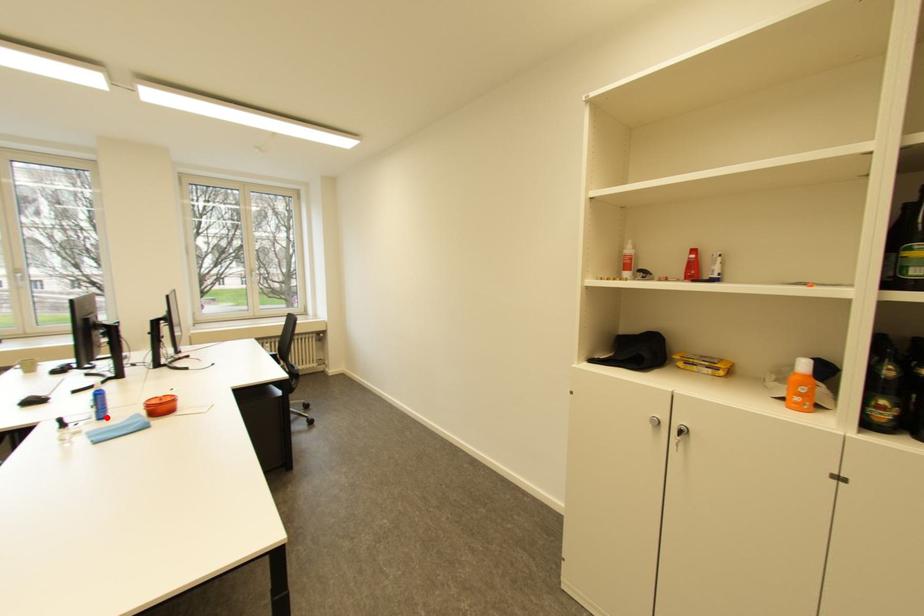
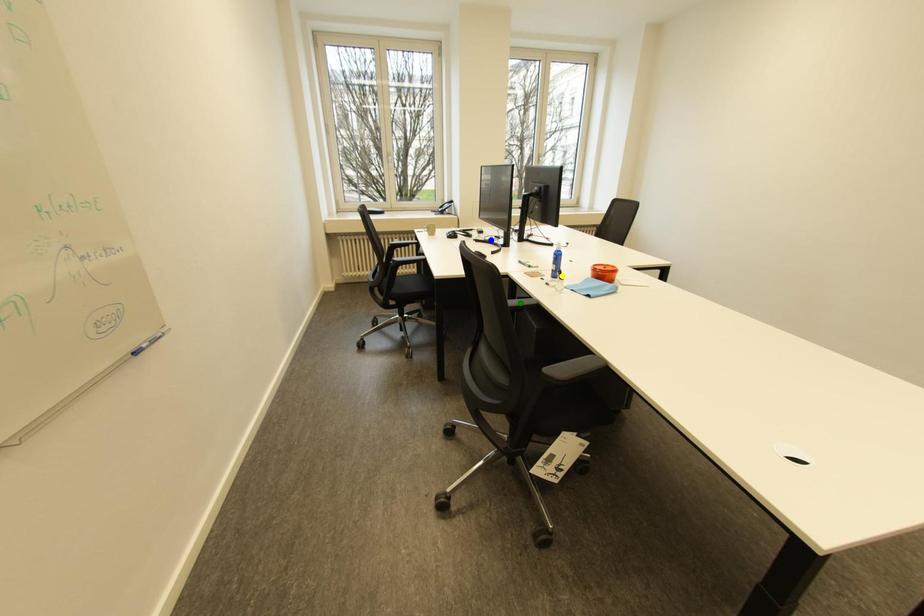
Question: I am providing you with two images of the same scene from different viewpoints. A red point is marked on the first image. You are given multiple points on the second image. Which point in image 2 is actually the same real-world point as the red point in image 1?

Choices:
 (A) blue point
 (B) yellow point
 (C) green point

Answer: (B)